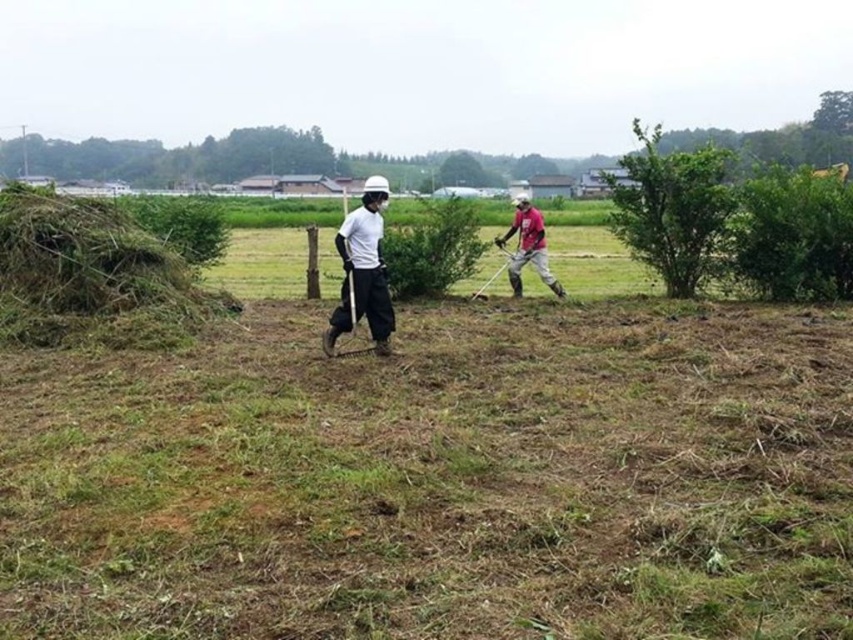
Is green leafy hedge at right wider than matte pink shirt at center?

Incorrect, green leafy hedge at right's width does not surpass matte pink shirt at center's.

Between point (740, 262) and point (519, 216), which one is positioned behind?

Positioned behind is point (519, 216).

Locate an element on the screen. This screenshot has height=640, width=853. green leafy hedge at right is located at coordinates (793, 234).

Which of these two, brown dry grass at center or green leafy hedge at right, stands shorter?

brown dry grass at center

Does point (198, 396) come behind point (839, 276)?

No, (198, 396) is closer to viewer.

Image resolution: width=853 pixels, height=640 pixels. Find the location of `brown dry grass at center`. brown dry grass at center is located at coordinates (438, 477).

Is brown dry grass at center thinner than white matte shirt at center?

No.

Is brown dry grass at center positioned behind white matte shirt at center?

No, brown dry grass at center is in front of white matte shirt at center.

The image size is (853, 640). Find the location of `brown dry grass at center`. brown dry grass at center is located at coordinates (438, 477).

The height and width of the screenshot is (640, 853). What are the coordinates of `brown dry grass at center` in the screenshot? It's located at (438, 477).